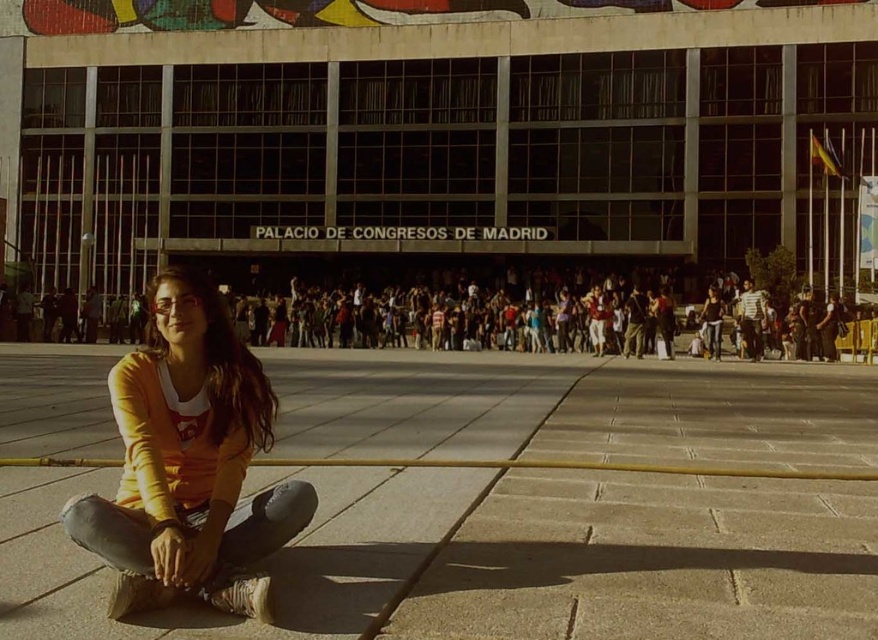
You are a photographer standing at the entrance of the Palacio de Congresos de Madrid. You want to capture a wide shot of the crowd and the building. Which object, the sandy concrete pavement at lower left or the orange cotton shirt at lower left, would occupy more space in your photo?

The sandy concrete pavement at lower left occupies more space in the photo because it is larger in size than the orange cotton shirt at lower left.

You are standing at the entrance of the Palacio de Congresos de Madrid and notice the sandy concrete pavement at lower left and the orange cotton shirt at lower left. Which object is positioned lower in the scene?

The sandy concrete pavement at lower left is located below the orange cotton shirt at lower left, so it is positioned lower in the scene.

You are standing at the entrance of the Palacio de Congresos de Madrid and notice a sandy concrete pavement at lower left and an orange cotton shirt at lower left. Which object is located more to the left?

The orange cotton shirt at lower left is more to the left because the sandy concrete pavement at lower left is positioned on its right side.